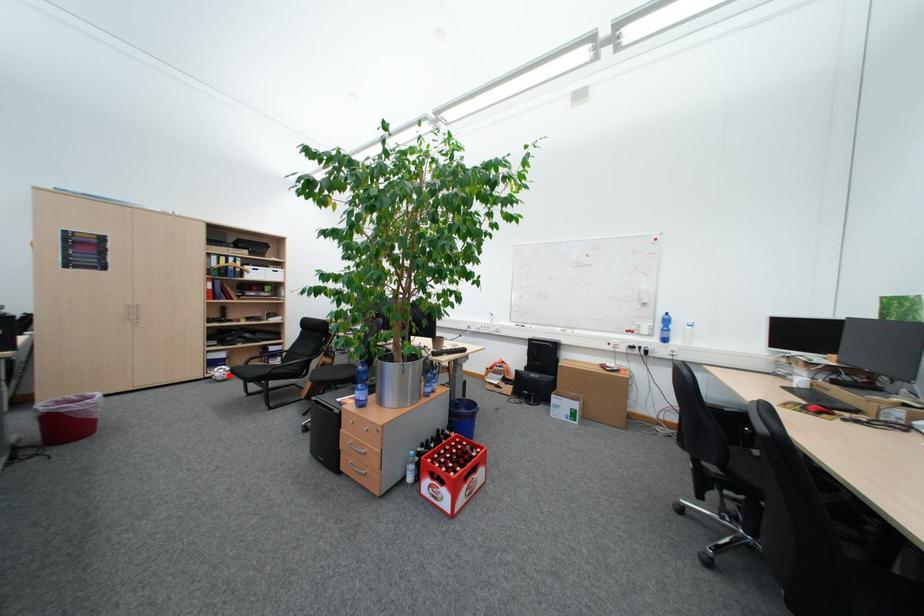
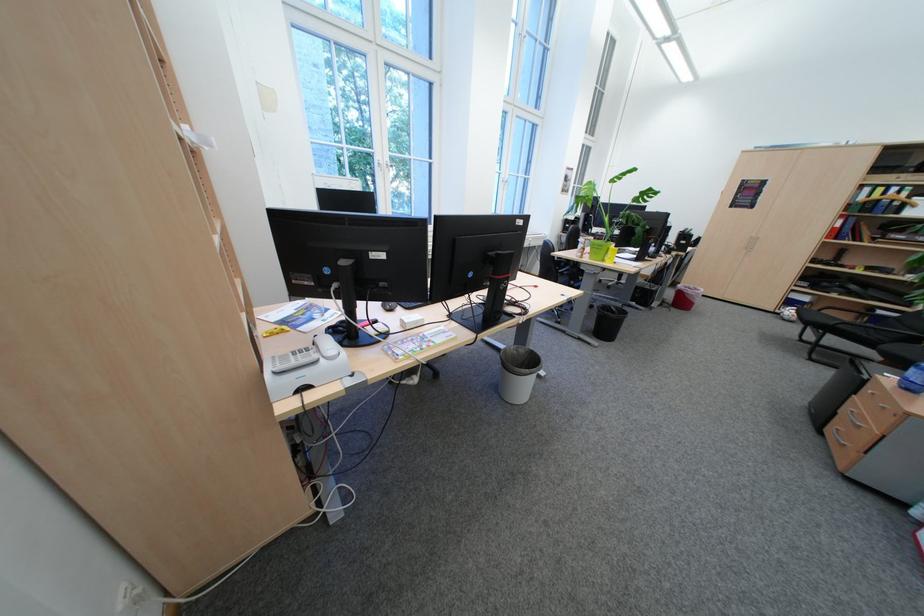
Question: I am providing you with two images of the same scene from different viewpoints. In image1, a red point is highlighted. Considering the same 3D point in image2, which of the following is correct?

Choices:
 (A) It is closer
 (B) It is farther

Answer: (B)